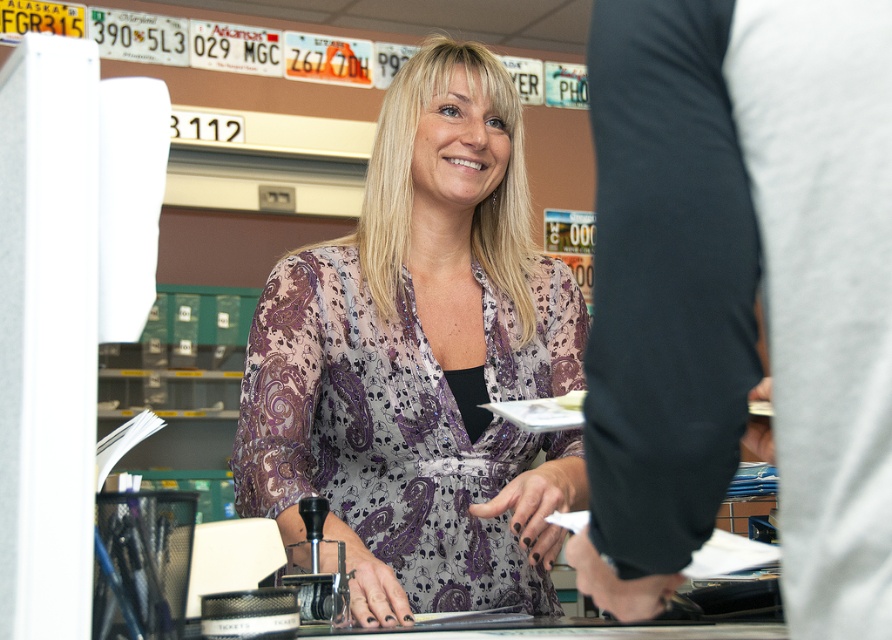
In the scene shown: Is white fabric pants at lower right thinner than purple paisley blouse at center?

Yes, white fabric pants at lower right is thinner than purple paisley blouse at center.

Is the position of white fabric pants at lower right more distant than that of purple paisley blouse at center?

No, it is not.

This screenshot has height=640, width=892. What do you see at coordinates (744, 285) in the screenshot? I see `white fabric pants at lower right` at bounding box center [744, 285].

You are a GUI agent. You are given a task and a screenshot of the screen. Output one action in this format:
    pyautogui.click(x=<x>, y=<y>)
    Task: Click on the white fabric pants at lower right
    This screenshot has height=640, width=892.
    Given the screenshot: What is the action you would take?
    pyautogui.click(x=744, y=285)